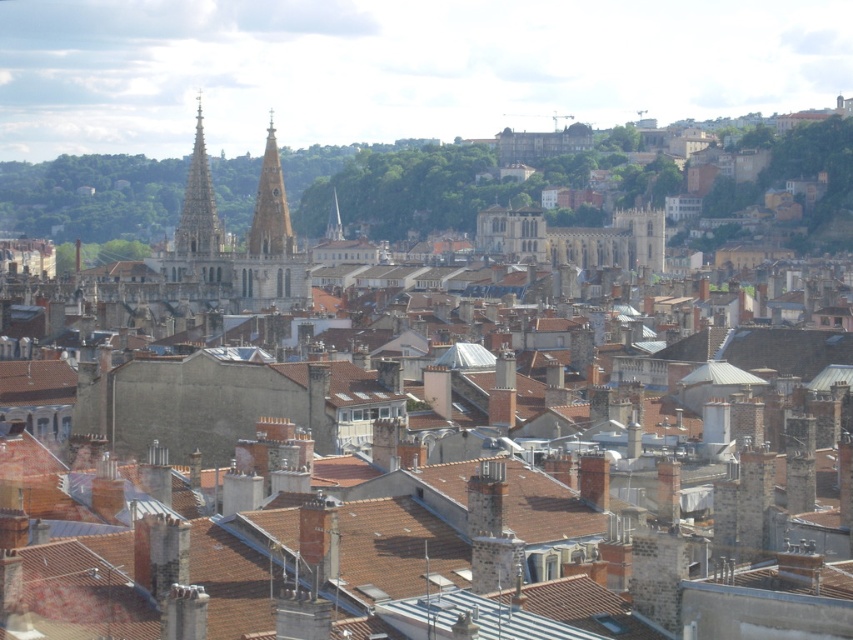
Question: Is smooth stone tower at center behind smooth stone spire at center?

Choices:
 (A) no
 (B) yes

Answer: (A)

Question: Does polished stone spire at upper left have a smaller size compared to smooth stone tower at center?

Choices:
 (A) yes
 (B) no

Answer: (B)

Question: Does marble-like stone tower at center appear under smooth stone spire at center?

Choices:
 (A) no
 (B) yes

Answer: (B)

Question: Which of the following is the farthest from the observer?

Choices:
 (A) smooth stone spire at center
 (B) marble-like stone tower at center
 (C) smooth stone tower at center
 (D) polished stone spire at upper left

Answer: (A)

Question: Which of the following is the farthest from the observer?

Choices:
 (A) (271, 198)
 (B) (334, 204)

Answer: (B)

Question: Which of the following is the farthest from the observer?

Choices:
 (A) smooth stone spire at center
 (B) smooth stone tower at center
 (C) marble-like stone tower at center

Answer: (A)